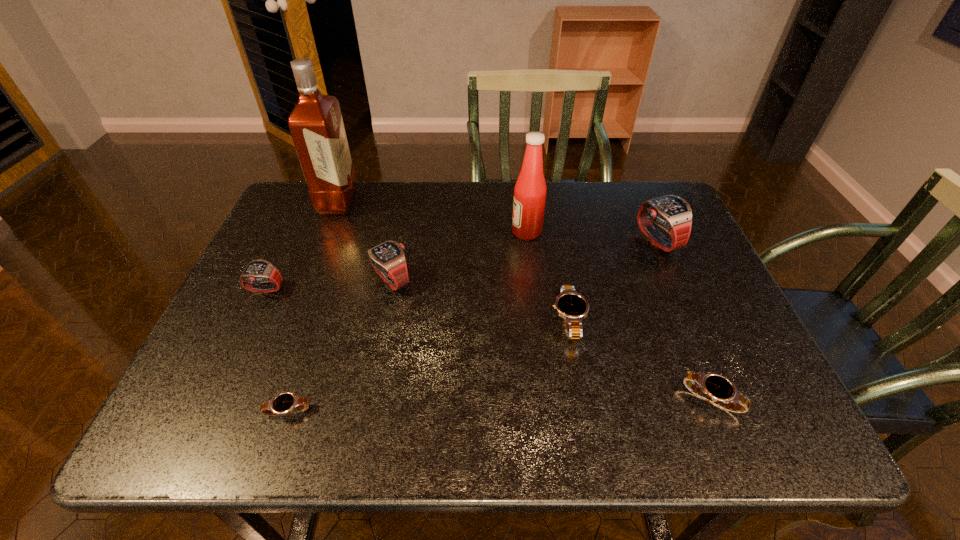
Where is `blank space located on the left of the tallest watch`? This screenshot has width=960, height=540. blank space located on the left of the tallest watch is located at coordinates (538, 241).

I want to click on vacant area located on the front of the second tallest watch, so click(x=373, y=367).

The height and width of the screenshot is (540, 960). What are the coordinates of `free region located on the back of the fifth tallest object` in the screenshot? It's located at (312, 192).

The height and width of the screenshot is (540, 960). Find the location of `vacant space located 0.300m on the back of the third watch from right to left`. vacant space located 0.300m on the back of the third watch from right to left is located at coordinates click(x=550, y=220).

I want to click on vacant area located 0.250m on the left of the second biggest black watch, so click(557, 398).

This screenshot has height=540, width=960. I want to click on free space located on the back of the fifth watch from right to left, so click(x=310, y=345).

Where is `liquor that is at the far edge`? liquor that is at the far edge is located at coordinates (316, 125).

Identify the location of condiment located at the far edge. The image size is (960, 540). (530, 190).

Identify the location of watch at the far edge. [x=672, y=213].

Identify the location of liquor that is at the left edge. (316, 125).